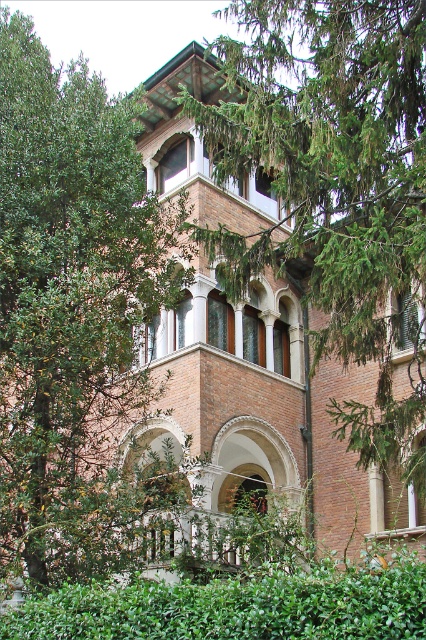
Where is `green leafy tree at center`? green leafy tree at center is located at coordinates (334, 186).

Can you confirm if green leafy tree at center is bigger than green leafy hedge at lower center?

Indeed, green leafy tree at center has a larger size compared to green leafy hedge at lower center.

Between point (422, 355) and point (256, 573), which one is positioned in front?

Point (256, 573) is in front.

Identify the location of green leafy tree at center. The image size is (426, 640). (334, 186).

Which is below, green leafy tree at left or green leafy hedge at lower center?

green leafy hedge at lower center

Locate an element on the screen. Image resolution: width=426 pixels, height=640 pixels. green leafy tree at left is located at coordinates (71, 307).

Locate an element on the screen. The height and width of the screenshot is (640, 426). green leafy tree at left is located at coordinates (71, 307).

Does green leafy tree at left appear on the left side of matte brick archway at center?

Correct, you'll find green leafy tree at left to the left of matte brick archway at center.

Where is `green leafy tree at left`? The width and height of the screenshot is (426, 640). green leafy tree at left is located at coordinates (71, 307).